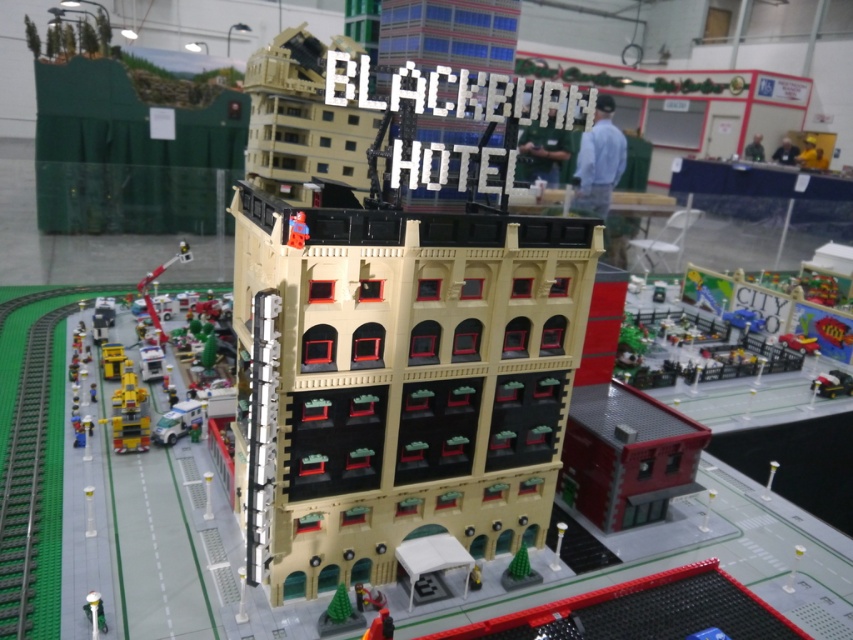
Question: Does beige plastic building at center appear over yellow plastic toy car at lower left?

Choices:
 (A) yes
 (B) no

Answer: (A)

Question: Which of the following is the closest to the observer?

Choices:
 (A) (364, 214)
 (B) (120, 422)

Answer: (A)

Question: Does beige plastic building at center have a lesser width compared to yellow plastic toy car at lower left?

Choices:
 (A) no
 (B) yes

Answer: (A)

Question: Which object appears closest to the camera in this image?

Choices:
 (A) beige plastic building at center
 (B) yellow plastic toy car at lower left

Answer: (A)

Question: Does beige plastic building at center have a lesser width compared to yellow plastic toy car at lower left?

Choices:
 (A) no
 (B) yes

Answer: (A)